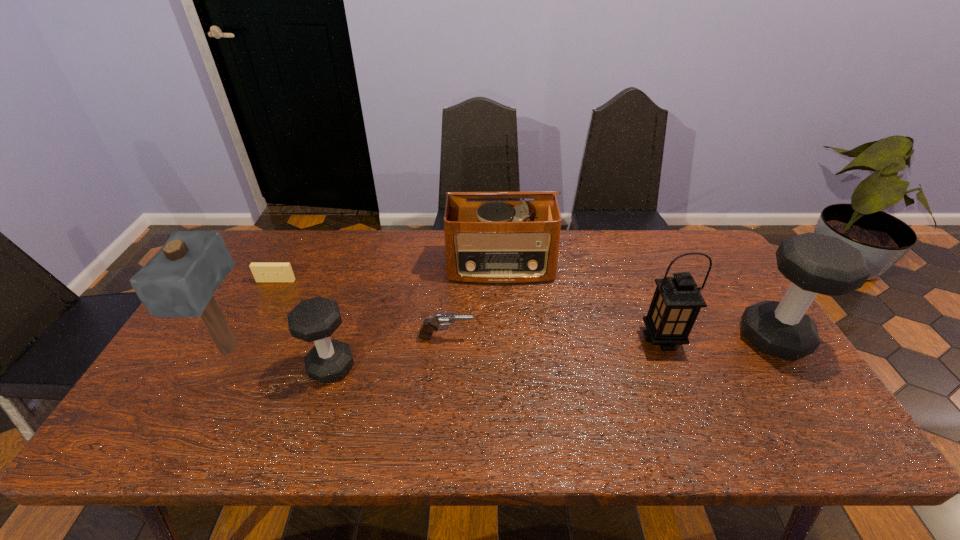
If equal spacing is desired by inserting an extra dumbbell among them, please point out a free spot for this new dumbbell. Please provide its 2D coordinates. Your answer should be formatted as a tuple, i.e. [(x, y)], where the tuple contains the x and y coordinates of a point satisfying the conditions above.

[(559, 352)]